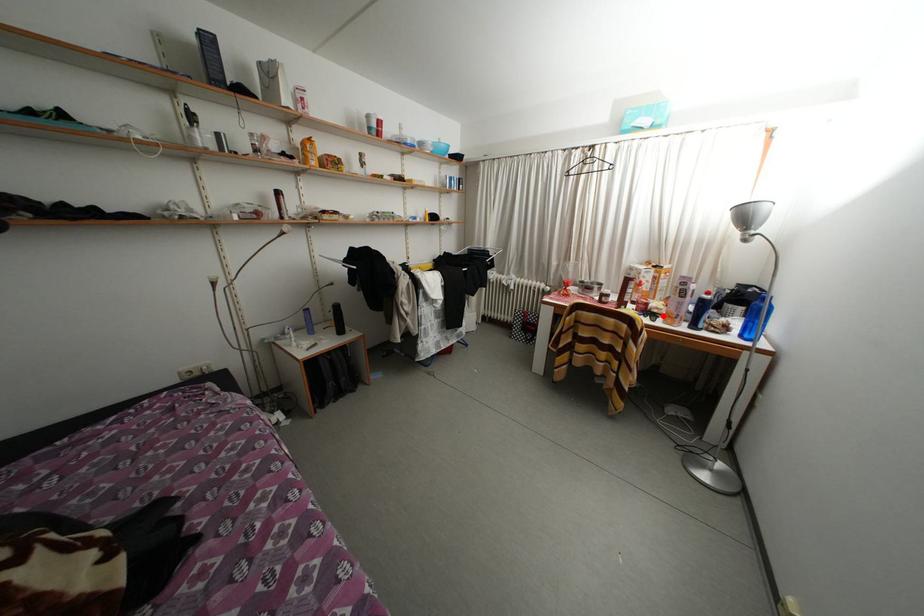
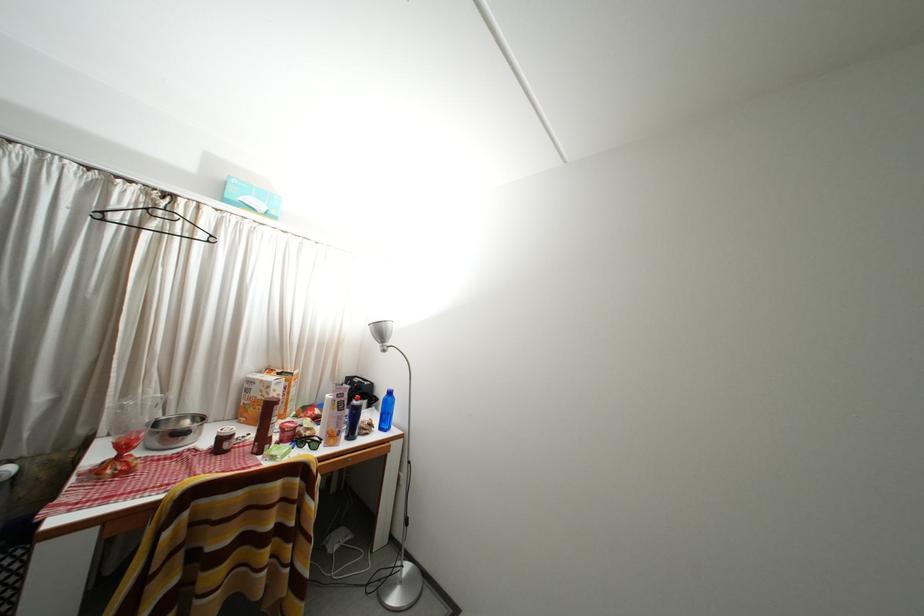
Locate, in the second image, the point that corresponds to the highlighted location in the first image.

(315, 439)